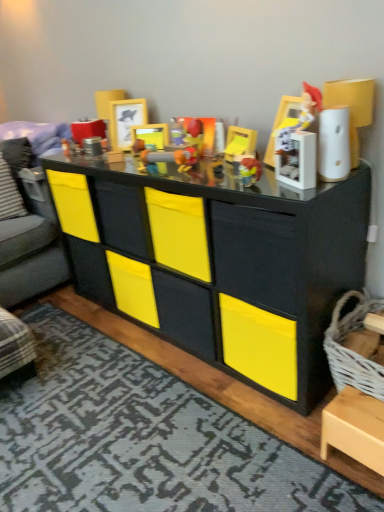
Image resolution: width=384 pixels, height=512 pixels. I want to click on matte plastic toy at center, the 2th toy in the left-to-right sequence, so click(x=190, y=145).

The width and height of the screenshot is (384, 512). What do you see at coordinates (222, 254) in the screenshot?
I see `black matte chest of drawers at center` at bounding box center [222, 254].

What is the approximate width of wooden picture frame at upper center, the first picture frame when ordered from back to front?

wooden picture frame at upper center, the first picture frame when ordered from back to front, is 9.07 centimeters wide.

Describe the element at coordinates (125, 121) in the screenshot. I see `wooden picture frame at upper center, acting as the 2th picture frame starting from the front` at that location.

Find the location of `white wicker basket at lower right`. white wicker basket at lower right is located at coordinates (351, 350).

Locate an element on the screen. Image resolution: width=384 pixels, height=512 pixels. matte plastic toy at center, the 2th toy in the left-to-right sequence is located at coordinates (190, 145).

From a real-world perspective, is striped fabric pillow at left positioned over wooden picture frame at upper center, the first picture frame when ordered from back to front, based on gravity?

No, from a real-world perspective, striped fabric pillow at left is not above wooden picture frame at upper center, the first picture frame when ordered from back to front.

Locate an element on the screen. picture frame that is the 1st object to the right of the striped fabric pillow at left, starting at the anchor is located at coordinates (125, 121).

Is there a large distance between striped fabric pillow at left and wooden picture frame at upper center, the first picture frame when ordered from back to front?

No, striped fabric pillow at left is in close proximity to wooden picture frame at upper center, the first picture frame when ordered from back to front.

From the image's perspective, is matte plastic toy at center, the 2th toy in the left-to-right sequence, located above or below plastic toy gun at center, which is the fifth toy from right to left?

From the image's perspective, matte plastic toy at center, the 2th toy in the left-to-right sequence, appears above plastic toy gun at center, which is the fifth toy from right to left.

Considering the sizes of objects matte plastic toy at center, which ranks as the 4th toy in right-to-left order, and plastic toy gun at center, arranged as the 1th toy when viewed from the left, in the image provided, who is taller, matte plastic toy at center, which ranks as the 4th toy in right-to-left order, or plastic toy gun at center, arranged as the 1th toy when viewed from the left,?

With more height is matte plastic toy at center, which ranks as the 4th toy in right-to-left order.

Are matte plastic toy at center, the 2th toy in the left-to-right sequence, and plastic toy gun at center, arranged as the 1th toy when viewed from the left, beside each other?

No, matte plastic toy at center, the 2th toy in the left-to-right sequence, is not next to plastic toy gun at center, arranged as the 1th toy when viewed from the left.

Based on the photo, considering the relative positions of matte plastic toy at center, which ranks as the 4th toy in right-to-left order, and plastic toy gun at center, arranged as the 1th toy when viewed from the left, in the image provided, is matte plastic toy at center, which ranks as the 4th toy in right-to-left order, to the right of plastic toy gun at center, arranged as the 1th toy when viewed from the left, from the viewer's perspective?

Yes.

Is light wood cabinet at lower right to the right of plastic toy gun at center, which is the fifth toy from right to left, from the viewer's perspective?

Correct, you'll find light wood cabinet at lower right to the right of plastic toy gun at center, which is the fifth toy from right to left.

Looking at this image, is light wood cabinet at lower right turned away from plastic toy gun at center, arranged as the 1th toy when viewed from the left?

That's not correct — light wood cabinet at lower right is not looking away from plastic toy gun at center, arranged as the 1th toy when viewed from the left.

From a real-world perspective, is light wood cabinet at lower right physically located above or below plastic toy gun at center, which is the fifth toy from right to left?

From a real-world perspective, light wood cabinet at lower right is physically below plastic toy gun at center, which is the fifth toy from right to left.

Is light wood cabinet at lower right far from plastic toy gun at center, which is the fifth toy from right to left?

Yes.

Which is farther from the camera, [160,162] or [370,394]?

The point [160,162] is farther from the camera.

Are plastic toy gun at center, arranged as the 1th toy when viewed from the left, and white wicker basket at lower right beside each other?

No, plastic toy gun at center, arranged as the 1th toy when viewed from the left, is not beside white wicker basket at lower right.

Considering the positions of objects plastic toy gun at center, arranged as the 1th toy when viewed from the left, and white wicker basket at lower right in the image provided, who is more to the left, plastic toy gun at center, arranged as the 1th toy when viewed from the left, or white wicker basket at lower right?

plastic toy gun at center, arranged as the 1th toy when viewed from the left.

Is plastic toy gun at center, which is the fifth toy from right to left, inside the boundaries of white wicker basket at lower right, or outside?

plastic toy gun at center, which is the fifth toy from right to left, is located beyond the bounds of white wicker basket at lower right.

Is matte wooden picture frame at center, the second picture frame positioned from the back, far from wooden picture frame at upper center, the first picture frame when ordered from back to front?

No, there isn't a large distance between matte wooden picture frame at center, the second picture frame positioned from the back, and wooden picture frame at upper center, the first picture frame when ordered from back to front.

Between matte wooden picture frame at center, the first picture frame viewed from the front, and wooden picture frame at upper center, the first picture frame when ordered from back to front, which one has larger size?

With larger size is wooden picture frame at upper center, the first picture frame when ordered from back to front.

In the scene shown: Considering the positions of objects matte wooden picture frame at center, the first picture frame viewed from the front, and wooden picture frame at upper center, the first picture frame when ordered from back to front, in the image provided, who is more to the left, matte wooden picture frame at center, the first picture frame viewed from the front, or wooden picture frame at upper center, the first picture frame when ordered from back to front,?

From the viewer's perspective, wooden picture frame at upper center, the first picture frame when ordered from back to front, appears more on the left side.

From a real-world perspective, between matte wooden picture frame at center, the second picture frame positioned from the back, and wooden picture frame at upper center, acting as the 2th picture frame starting from the front, who is vertically lower?

In real-world perspective, matte wooden picture frame at center, the second picture frame positioned from the back, is lower.

Is white wicker basket at lower right inside matte wooden picture frame at center, the second picture frame positioned from the back?

No, white wicker basket at lower right is not inside matte wooden picture frame at center, the second picture frame positioned from the back.

Considering the relative sizes of matte wooden picture frame at center, the second picture frame positioned from the back, and white wicker basket at lower right in the image provided, is matte wooden picture frame at center, the second picture frame positioned from the back, smaller than white wicker basket at lower right?

Yes.

Is white wicker basket at lower right in front of or behind wooden picture frame at upper center, acting as the 2th picture frame starting from the front, in the image?

Visually, white wicker basket at lower right is located in front of wooden picture frame at upper center, acting as the 2th picture frame starting from the front.

Considering the relative sizes of white wicker basket at lower right and wooden picture frame at upper center, the first picture frame when ordered from back to front, in the image provided, is white wicker basket at lower right smaller than wooden picture frame at upper center, the first picture frame when ordered from back to front,?

No, white wicker basket at lower right is not smaller than wooden picture frame at upper center, the first picture frame when ordered from back to front.

Is wooden picture frame at upper center, acting as the 2th picture frame starting from the front, a part of white wicker basket at lower right?

That's incorrect, wooden picture frame at upper center, acting as the 2th picture frame starting from the front, is not inside white wicker basket at lower right.

Which is behind, point (342, 374) or point (114, 119)?

The point (114, 119) is more distant.

From the striped fabric pillow at left, count 1st picture frame to the right and point to it. Please provide its 2D coordinates.

[(125, 121)]

Which toy is the 2nd one when counting from the back of the plastic toy gun at center, which is the fifth toy from right to left? Please provide its 2D coordinates.

[(190, 145)]

When comparing their distances from matte plastic toy at center, placed as the third toy when sorted from right to left, does translucent plastic toy at center, acting as the 4th toy starting from the left, or wooden picture frame at upper center, the first picture frame when ordered from back to front, seem further?

wooden picture frame at upper center, the first picture frame when ordered from back to front.

From the image, which object appears to be farther from white wicker basket at lower right, light wood cabinet at lower right or matte plastic toy at center, which ranks as the 4th toy in right-to-left order?

matte plastic toy at center, which ranks as the 4th toy in right-to-left order, lies further to white wicker basket at lower right than the other object.

From the image, which object appears to be farther from white glossy figurine at upper right, the 1th toy viewed from the right, light wood cabinet at lower right or matte wooden picture frame at center, the second picture frame positioned from the back?

Based on the image, light wood cabinet at lower right appears to be further to white glossy figurine at upper right, the 1th toy viewed from the right.

Which object lies nearer to the anchor point plastic toy gun at center, which is the fifth toy from right to left, black matte chest of drawers at center or matte plastic toy at center, which ranks as the third toy in left-to-right order?

matte plastic toy at center, which ranks as the third toy in left-to-right order, lies closer to plastic toy gun at center, which is the fifth toy from right to left, than the other object.

Which object lies further to the anchor point striped fabric pillow at left, white wicker basket at lower right or matte wooden picture frame at center, the second picture frame positioned from the back?

Among the two, white wicker basket at lower right is located further to striped fabric pillow at left.

Considering their positions, is black matte chest of drawers at center positioned further to light wood cabinet at lower right than striped fabric pillow at left?

striped fabric pillow at left is further to light wood cabinet at lower right.

Looking at the image, which one is located further to matte plastic toy at center, which ranks as the 4th toy in right-to-left order, matte plastic toy at center, which ranks as the third toy in left-to-right order, or light wood cabinet at lower right?

light wood cabinet at lower right is further to matte plastic toy at center, which ranks as the 4th toy in right-to-left order.

Based on their spatial positions, is matte plastic toy at center, which ranks as the 4th toy in right-to-left order, or plastic toy gun at center, which is the fifth toy from right to left, closer to white glossy figurine at upper right, placed as the 5th toy when sorted from left to right?

matte plastic toy at center, which ranks as the 4th toy in right-to-left order.

You are a GUI agent. You are given a task and a screenshot of the screen. Output one action in this format:
    pyautogui.click(x=<x>, y=<y>)
    Task: Click on the chest of drawers situated between striped fabric pillow at left and translucent plastic toy at center, arranged as the 2th toy when viewed from the right, from left to right
    The height and width of the screenshot is (512, 384).
    Given the screenshot: What is the action you would take?
    pyautogui.click(x=222, y=254)

Where is `chest of drawers between translucent plastic toy at center, acting as the 4th toy starting from the left, and light wood cabinet at lower right, in the vertical direction`? Image resolution: width=384 pixels, height=512 pixels. chest of drawers between translucent plastic toy at center, acting as the 4th toy starting from the left, and light wood cabinet at lower right, in the vertical direction is located at coordinates (222, 254).

At what (x,y) coordinates should I click in order to perform the action: click on picture frame between striped fabric pillow at left and matte wooden picture frame at center, the first picture frame viewed from the front, in the horizontal direction. Please return your answer as a coordinate pair (x, y). The width and height of the screenshot is (384, 512). Looking at the image, I should click on (125, 121).

Find the location of `toy that lies between matte plastic toy at center, which ranks as the third toy in left-to-right order, and light wood cabinet at lower right from top to bottom`. toy that lies between matte plastic toy at center, which ranks as the third toy in left-to-right order, and light wood cabinet at lower right from top to bottom is located at coordinates (250, 170).